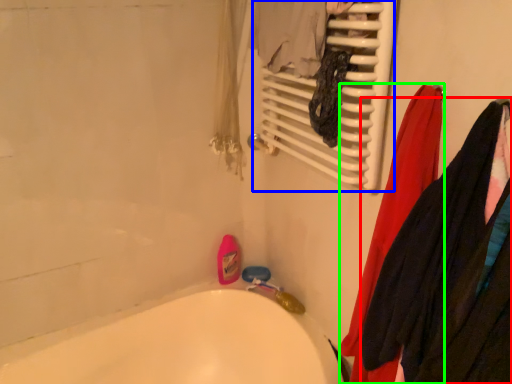
Question: Based on their relative distances, which object is nearer to clothing (highlighted by a red box)? Choose from radiator (highlighted by a blue box) and clothing (highlighted by a green box).

Choices:
 (A) radiator
 (B) clothing

Answer: (B)